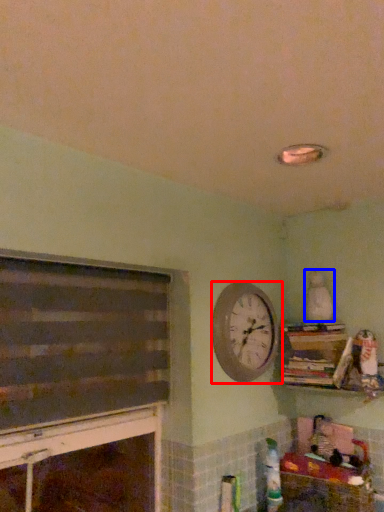
Question: Which object appears farthest to the camera in this image, wall clock (highlighted by a red box) or toy (highlighted by a blue box)?

Choices:
 (A) wall clock
 (B) toy

Answer: (B)